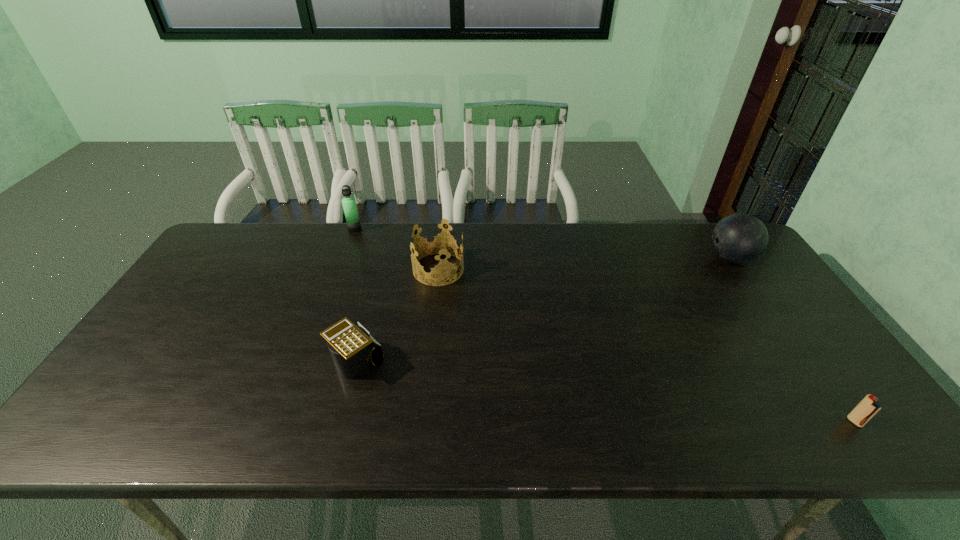
The width and height of the screenshot is (960, 540). In order to click on the third closest object relative to the third object from right to left in this screenshot , I will do `click(739, 238)`.

I want to click on free space that satisfies the following two spatial constraints: 1. on the grip area of the bowling ball; 2. on the back side of the shortest object, so click(842, 422).

Locate an element on the screen. vacant space that satisfies the following two spatial constraints: 1. on the front side of the crown; 2. on the left side of the shortest object is located at coordinates (421, 422).

Locate an element on the screen. The image size is (960, 540). vacant position in the image that satisfies the following two spatial constraints: 1. on the grip area of the shortest object; 2. on the left side of the bowling ball is located at coordinates (842, 422).